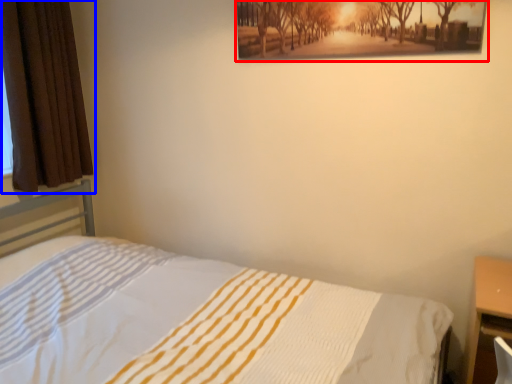
Question: Among these objects, which one is nearest to the camera, picture frame (highlighted by a red box) or curtain (highlighted by a blue box)?

Choices:
 (A) picture frame
 (B) curtain

Answer: (A)